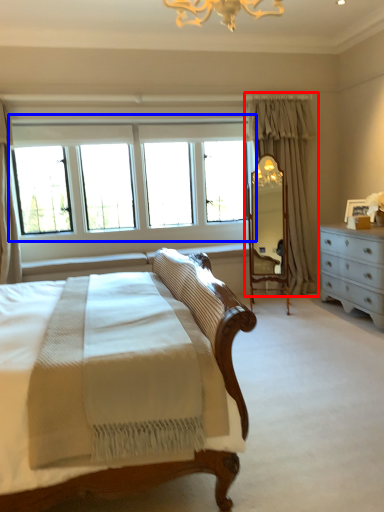
Question: Which point is closer to the camera, curtain (highlighted by a red box) or window (highlighted by a blue box)?

Choices:
 (A) curtain
 (B) window

Answer: (B)